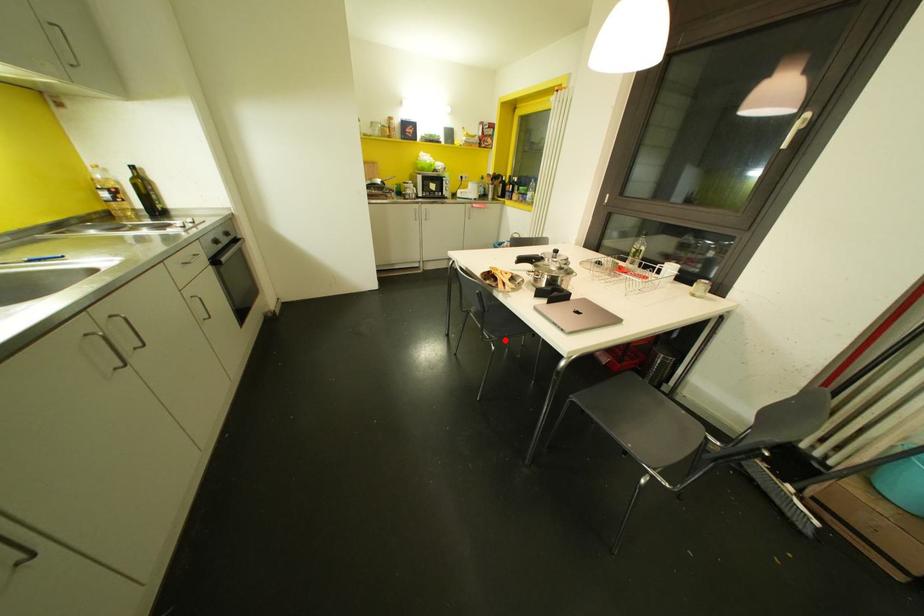
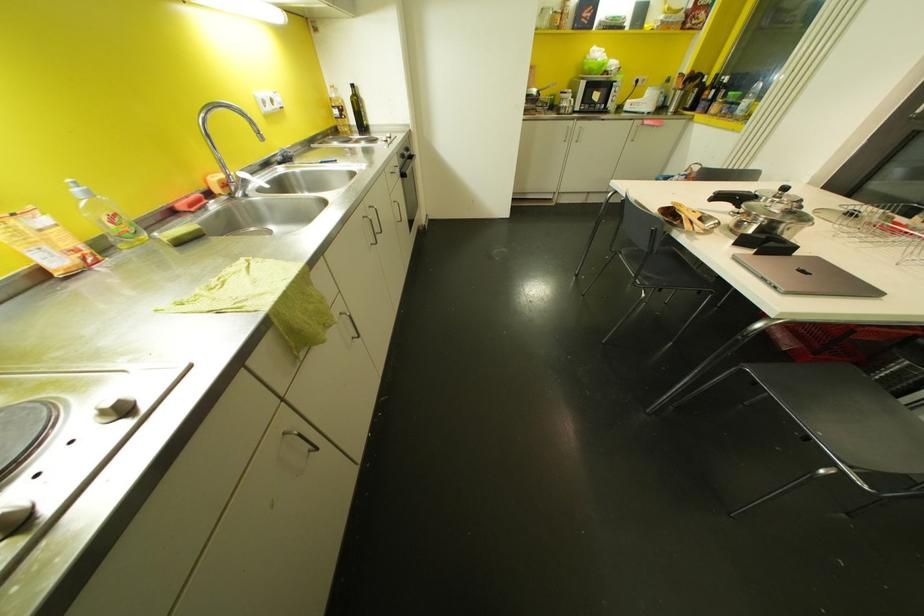
Where in the second image is the point corresponding to the highlighted location from the first image?

(660, 290)